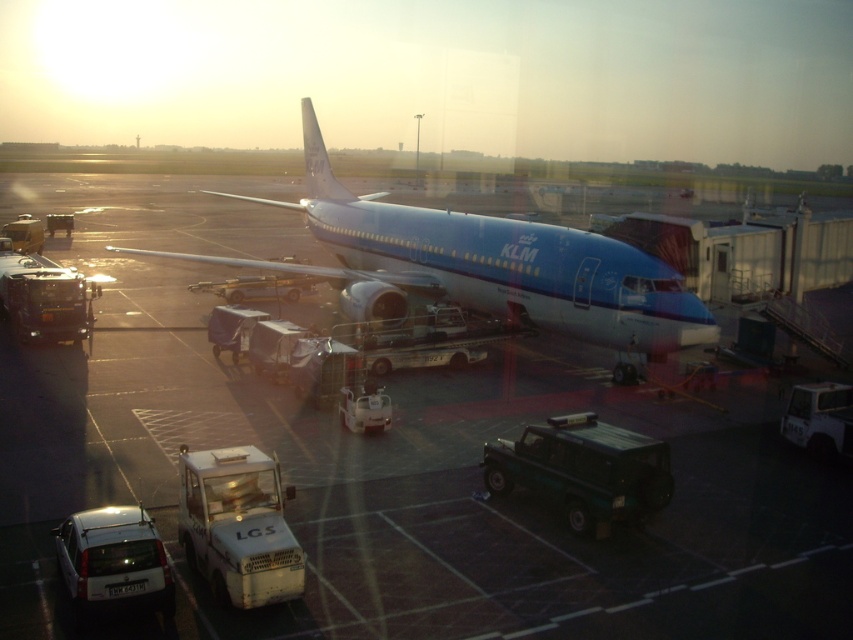
You are standing at the airport gate where the KLM Royal Dutch Airlines aircraft is parked. You notice two points marked on the ground at coordinates point (39, 180) and point (584, 273). If you want to reach the point closer to the camera, which coordinate should you walk towards?

You should walk towards point (39, 180) because it is further to the camera than point (584, 273).

You are a passenger at the airport and see two airplanes, the blue polished airplane at center and the blue glossy airplane at center. Which one is closer to you?

The blue polished airplane at center is closer to you since it is in front of the blue glossy airplane at center.

You are a pilot standing at the airport gate. You need to locate the blue polished airplane at center for your next flight. According to the airport map, where exactly is it located?

The blue polished airplane at center is located at point (390, 461) on the airport map.